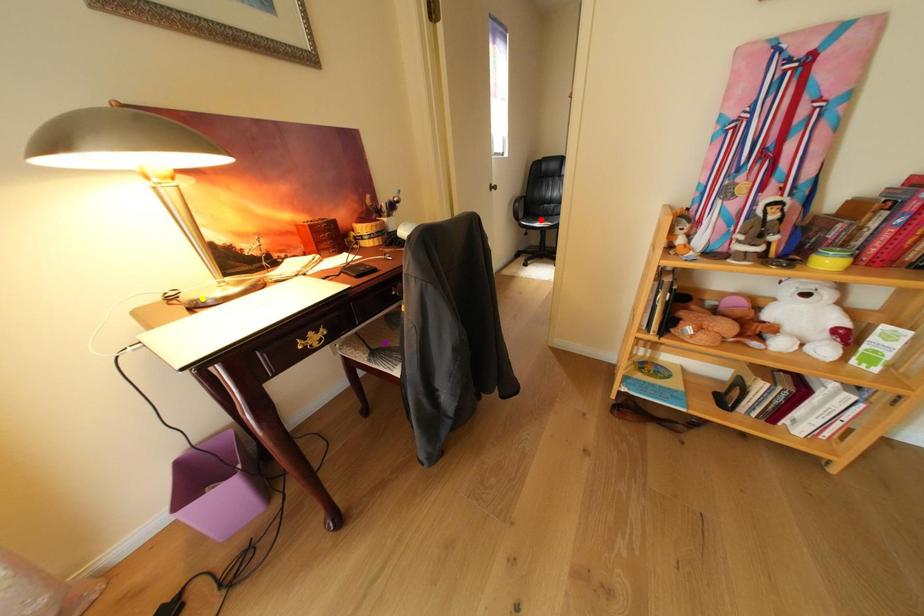
Order these from nearest to farthest:
purple point
red point
yellow point

yellow point → purple point → red point